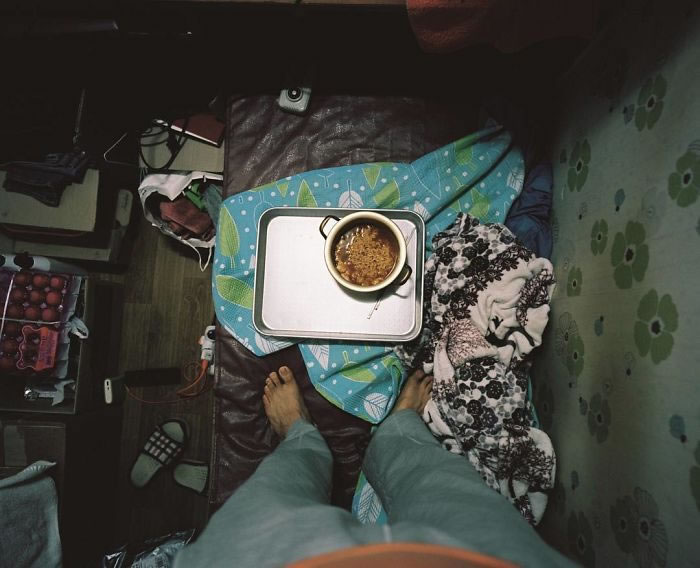
I want to click on floor, so click(154, 309).